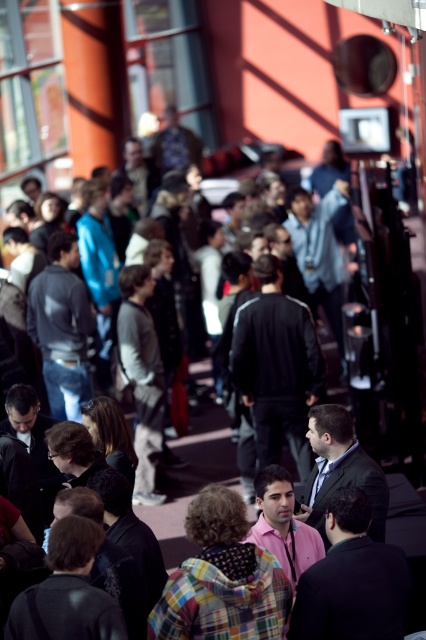
You are an event planner arranging a photo shoot in the described scene. You need to position a camera to capture both the black matte jacket at center and the dark gray suit at center clearly. Since both are at the center, will the camera need to adjust its focus to include both subjects?

The black matte jacket at center is located above the dark gray suit at center, so the camera should focus on the upper part of the frame to capture both subjects clearly without needing to adjust focus depth, as they are vertically aligned.

You are at an event and need to locate two people wearing a denim jacket at center and a dark gray suit at center. Which one is taller?

The denim jacket at center is taller than the dark gray suit at center.